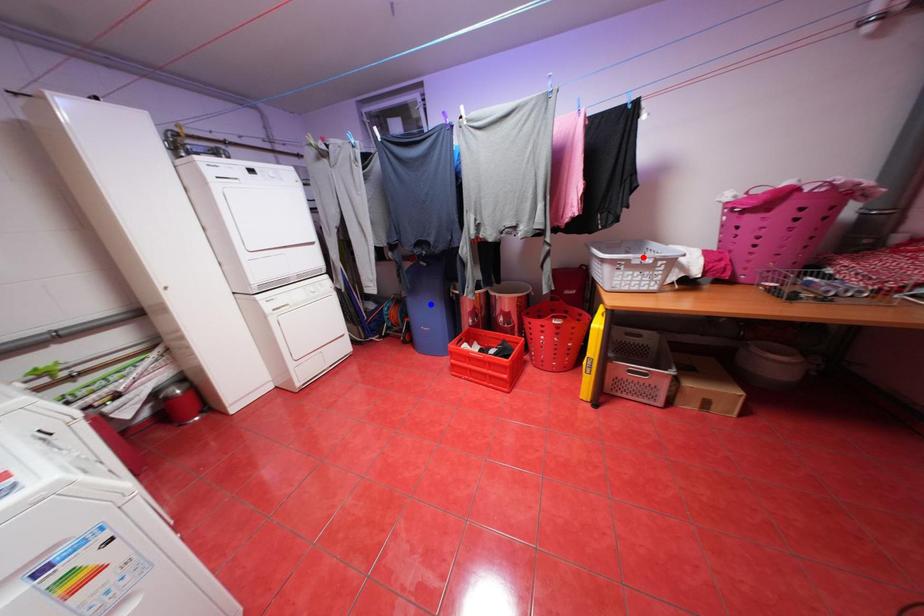
Question: Two points are marked on the image. Which point is closer to the camera?

Choices:
 (A) Blue point is closer.
 (B) Red point is closer.

Answer: (B)